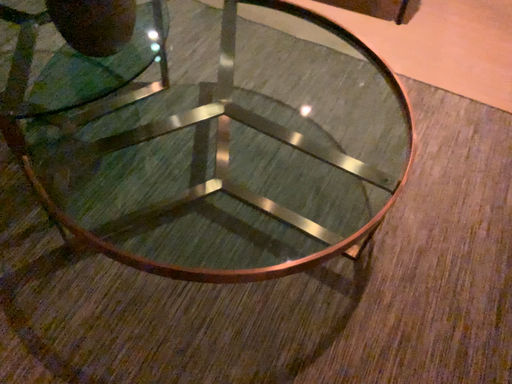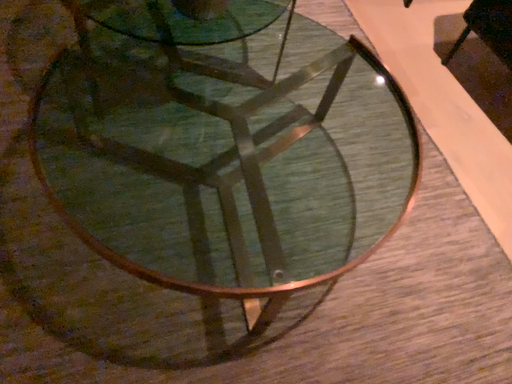
Question: How did the camera likely rotate when shooting the video?

Choices:
 (A) rotated right
 (B) rotated left

Answer: (B)